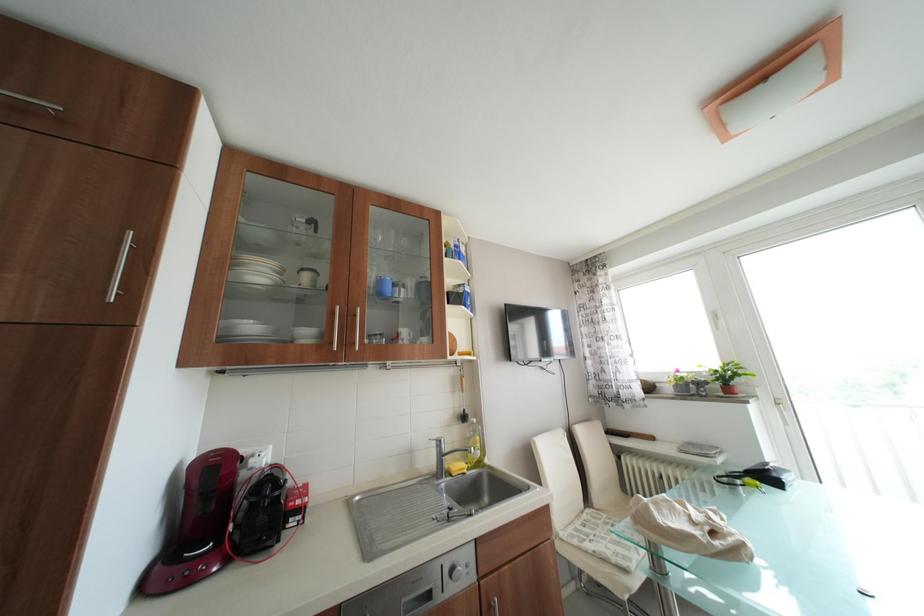
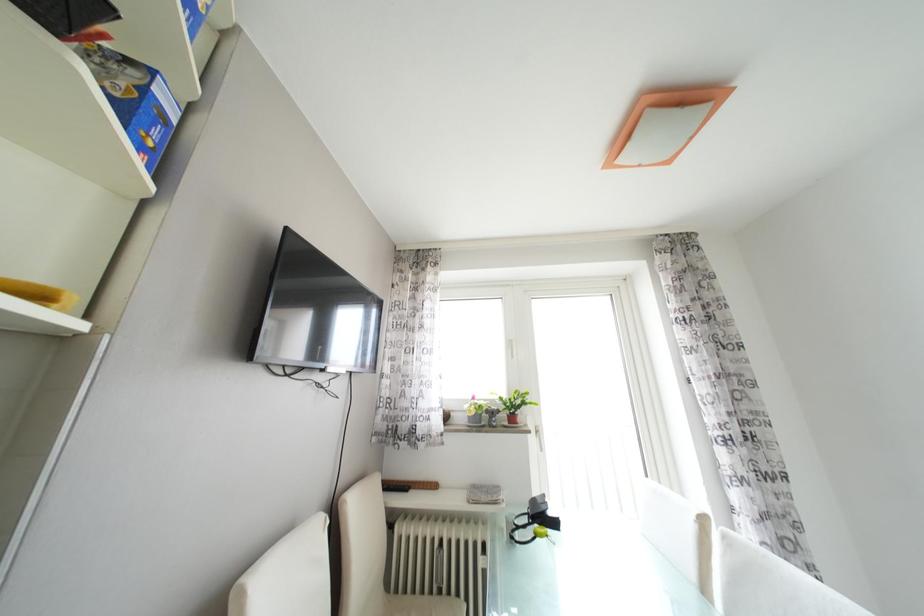
Question: The camera is either moving clockwise (left) or counter-clockwise (right) around the object. The first image is from the beginning of the video and the second image is from the end. Is the camera moving left or right when shooting the video?

Choices:
 (A) Left
 (B) Right

Answer: (A)